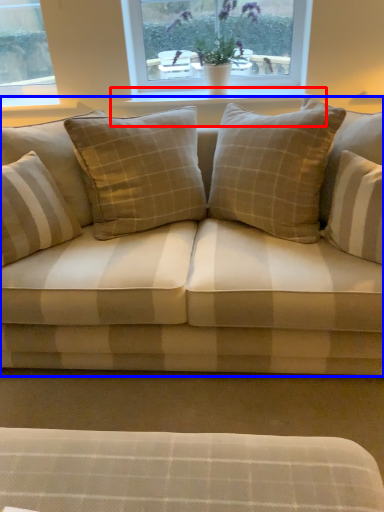
Question: Which object appears closest to the camera in this image, window sill (highlighted by a red box) or studio couch (highlighted by a blue box)?

Choices:
 (A) window sill
 (B) studio couch

Answer: (B)